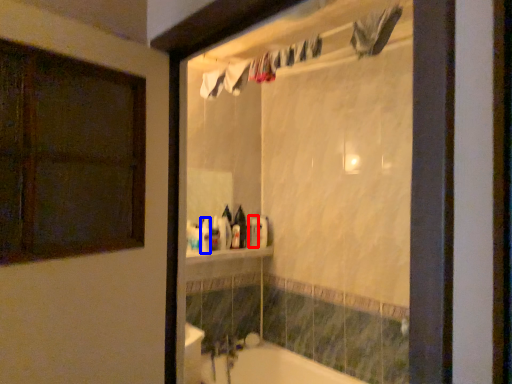
Question: Which object is closer to the camera taking this photo, toiletry (highlighted by a red box) or toiletry (highlighted by a blue box)?

Choices:
 (A) toiletry
 (B) toiletry

Answer: (B)